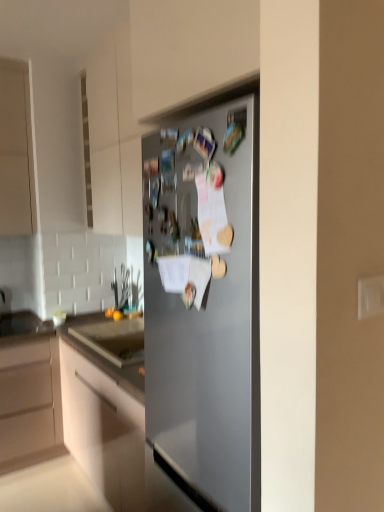
Question: Considering the relative positions of satin silver fridge at center and matte white cabinet at center in the image provided, is satin silver fridge at center to the left of matte white cabinet at center from the viewer's perspective?

Choices:
 (A) yes
 (B) no

Answer: (B)

Question: Is satin silver fridge at center shorter than matte white cabinet at center?

Choices:
 (A) no
 (B) yes

Answer: (B)

Question: Could you tell me if satin silver fridge at center is turned towards matte white cabinet at center?

Choices:
 (A) no
 (B) yes

Answer: (A)

Question: Is satin silver fridge at center located outside matte white cabinet at center?

Choices:
 (A) yes
 (B) no

Answer: (A)

Question: From a real-world perspective, is satin silver fridge at center located beneath matte white cabinet at center?

Choices:
 (A) yes
 (B) no

Answer: (B)

Question: Is satin silver fridge at center far away from matte white cabinet at center?

Choices:
 (A) yes
 (B) no

Answer: (B)

Question: Are matte white cabinet at center and satin silver fridge at center far apart?

Choices:
 (A) no
 (B) yes

Answer: (A)

Question: Is matte white cabinet at center thinner than satin silver fridge at center?

Choices:
 (A) no
 (B) yes

Answer: (A)

Question: Can you confirm if matte white cabinet at center is bigger than satin silver fridge at center?

Choices:
 (A) yes
 (B) no

Answer: (A)

Question: Could satin silver fridge at center be considered to be inside matte white cabinet at center?

Choices:
 (A) no
 (B) yes

Answer: (A)

Question: Can you confirm if matte white cabinet at center is smaller than satin silver fridge at center?

Choices:
 (A) yes
 (B) no

Answer: (B)

Question: Considering the relative sizes of matte white cabinet at center and satin silver fridge at center in the image provided, is matte white cabinet at center shorter than satin silver fridge at center?

Choices:
 (A) no
 (B) yes

Answer: (A)

Question: In terms of width, does satin silver fridge at center look wider or thinner when compared to matte white cabinet at center?

Choices:
 (A) thin
 (B) wide

Answer: (A)